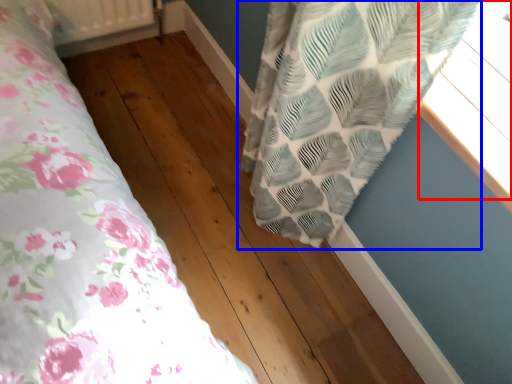
Question: Which point is further to the camera, window (highlighted by a red box) or curtain (highlighted by a blue box)?

Choices:
 (A) window
 (B) curtain

Answer: (B)